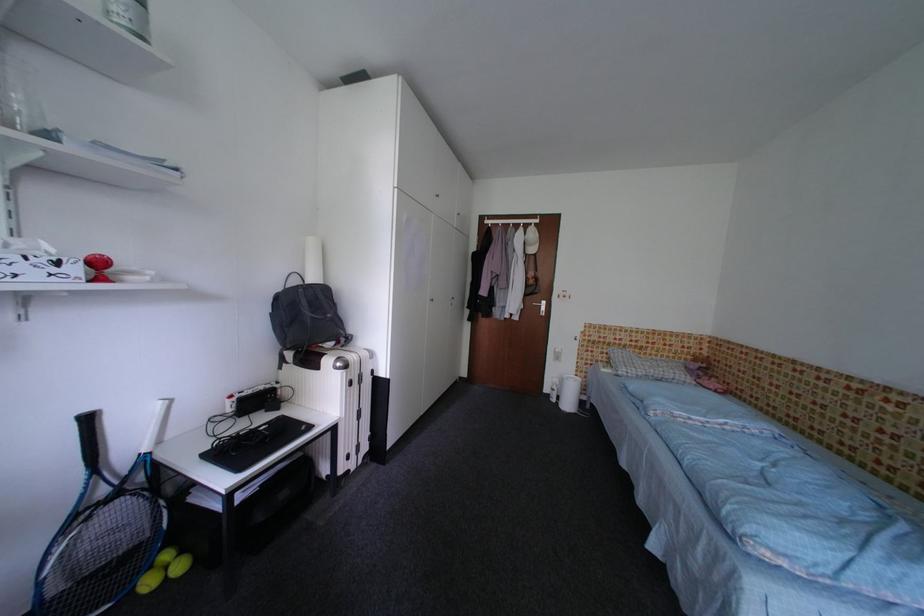
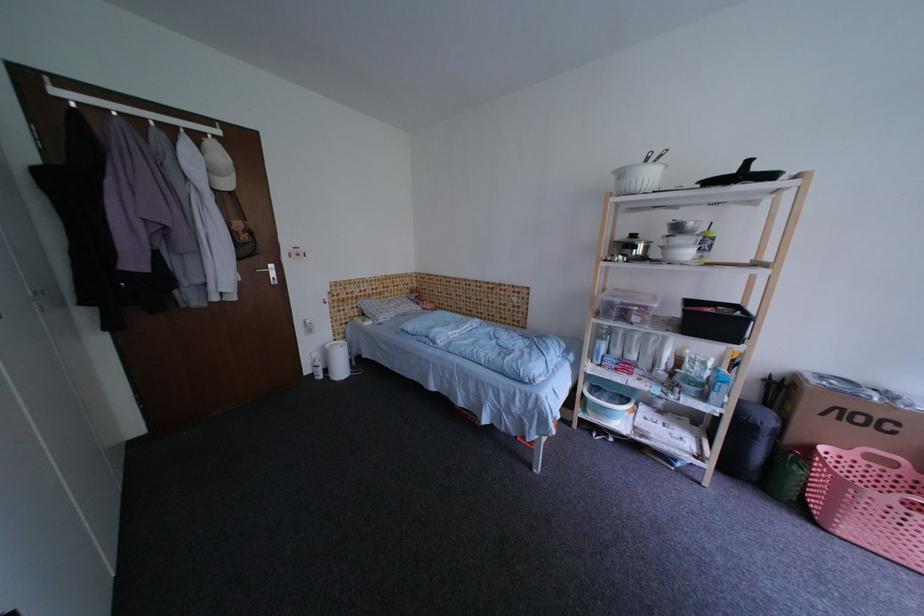
The point at (563, 390) is marked in the first image. Where is the corresponding point in the second image?

(326, 366)